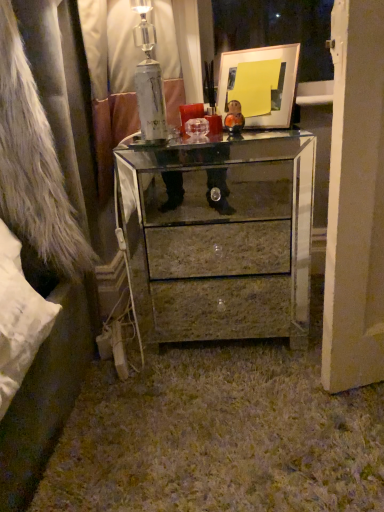
This screenshot has height=512, width=384. What are the coordinates of `free region under mirrored glass chest of drawers at center (from a real-world perspective)` in the screenshot? It's located at (220, 332).